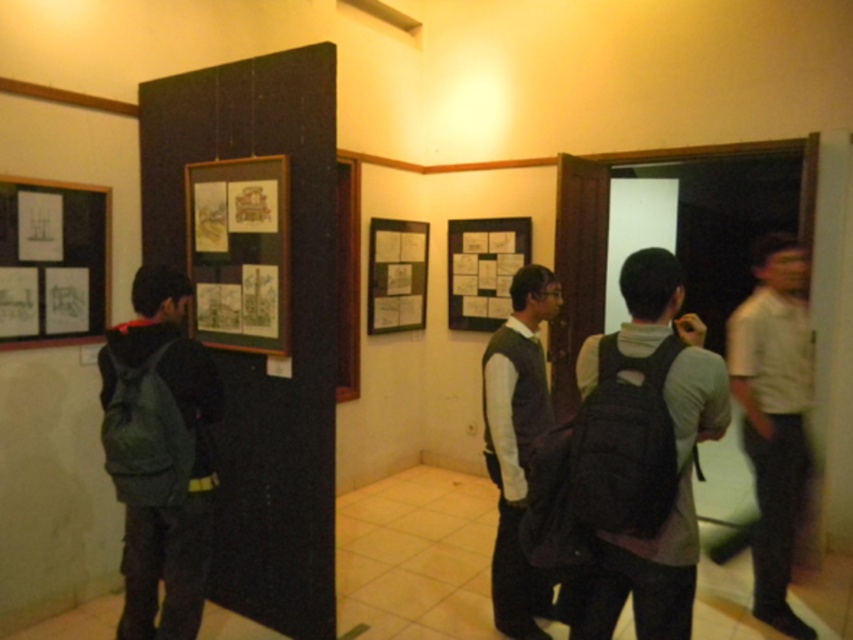
Question: Which object is positioned farthest from the black fabric backpack at center?

Choices:
 (A) dark gray sweater at center
 (B) green fabric backpack at left
 (C) matte paper poster at center

Answer: (C)

Question: Observing the image, what is the correct spatial positioning of dark gray sweater at center in reference to matte paper poster at center?

Choices:
 (A) below
 (B) above

Answer: (A)

Question: Which of the following is the closest to the observer?

Choices:
 (A) (393, 243)
 (B) (689, 557)
 (C) (140, 362)
 (D) (526, 360)

Answer: (B)

Question: Among these points, which one is farthest from the camera?

Choices:
 (A) (767, 380)
 (B) (537, 368)
 (C) (6, 189)

Answer: (A)

Question: Does green fabric backpack at left appear over white paper posters at left?

Choices:
 (A) yes
 (B) no

Answer: (B)

Question: Does white paper posters at left come behind matte paper poster at center?

Choices:
 (A) yes
 (B) no

Answer: (B)